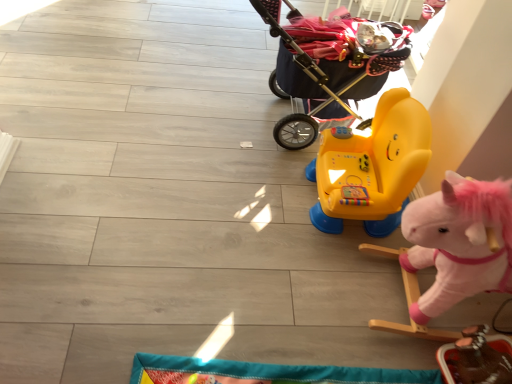
Question: Considering the relative sizes of yellow plastic ride-on toy at center, arranged as the 3th toy when ordered from the bottom, and fluffy pink rocking horse at right, the second toy when ordered from top to bottom, in the image provided, is yellow plastic ride-on toy at center, arranged as the 3th toy when ordered from the bottom, taller than fluffy pink rocking horse at right, the second toy when ordered from top to bottom,?

Choices:
 (A) yes
 (B) no

Answer: (B)

Question: Considering the relative sizes of yellow plastic ride-on toy at center, the 1th toy positioned from the top, and fluffy pink rocking horse at right, the 2th toy when ordered from bottom to top, in the image provided, is yellow plastic ride-on toy at center, the 1th toy positioned from the top, shorter than fluffy pink rocking horse at right, the 2th toy when ordered from bottom to top,?

Choices:
 (A) no
 (B) yes

Answer: (B)

Question: Is yellow plastic ride-on toy at center, arranged as the 3th toy when ordered from the bottom, positioned with its back to fluffy pink rocking horse at right, the 2th toy when ordered from bottom to top?

Choices:
 (A) no
 (B) yes

Answer: (A)

Question: Is fluffy pink rocking horse at right, the 2th toy when ordered from bottom to top, inside yellow plastic ride-on toy at center, arranged as the 3th toy when ordered from the bottom?

Choices:
 (A) yes
 (B) no

Answer: (B)

Question: Is yellow plastic ride-on toy at center, the 1th toy positioned from the top, wider than fluffy pink rocking horse at right, the second toy when ordered from top to bottom?

Choices:
 (A) yes
 (B) no

Answer: (B)

Question: Can you confirm if yellow plastic ride-on toy at center, arranged as the 3th toy when ordered from the bottom, is positioned to the left of fluffy pink rocking horse at right, the 2th toy when ordered from bottom to top?

Choices:
 (A) no
 (B) yes

Answer: (B)

Question: Could you tell me if yellow plastic ride-on toy at center, the 1th toy positioned from the top, is facing dark blue fabric baby carriage at upper right?

Choices:
 (A) no
 (B) yes

Answer: (A)

Question: From the image's perspective, is yellow plastic ride-on toy at center, the 1th toy positioned from the top, on dark blue fabric baby carriage at upper right?

Choices:
 (A) yes
 (B) no

Answer: (B)

Question: Considering the relative positions of yellow plastic ride-on toy at center, the 1th toy positioned from the top, and dark blue fabric baby carriage at upper right in the image provided, is yellow plastic ride-on toy at center, the 1th toy positioned from the top, to the right of dark blue fabric baby carriage at upper right from the viewer's perspective?

Choices:
 (A) no
 (B) yes

Answer: (B)

Question: Is the position of yellow plastic ride-on toy at center, arranged as the 3th toy when ordered from the bottom, less distant than that of dark blue fabric baby carriage at upper right?

Choices:
 (A) yes
 (B) no

Answer: (A)

Question: Can we say yellow plastic ride-on toy at center, arranged as the 3th toy when ordered from the bottom, lies outside dark blue fabric baby carriage at upper right?

Choices:
 (A) no
 (B) yes

Answer: (B)

Question: Are yellow plastic ride-on toy at center, arranged as the 3th toy when ordered from the bottom, and dark blue fabric baby carriage at upper right far apart?

Choices:
 (A) no
 (B) yes

Answer: (A)

Question: From the image's perspective, is fluffy pink rocking horse at right, the second toy when ordered from top to bottom, under yellow plastic ride-on toy at center, the 1th toy positioned from the top?

Choices:
 (A) no
 (B) yes

Answer: (B)